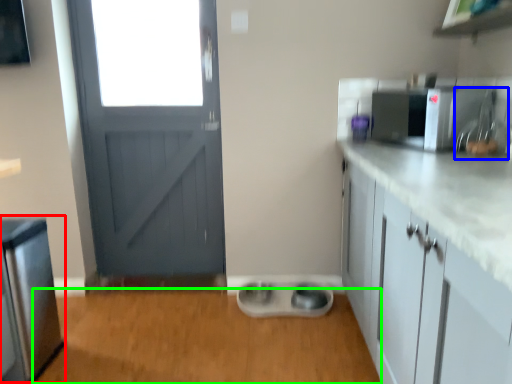
Question: Which object is positioned closest to appliance (highlighted by a red box)? Select from sink (highlighted by a blue box) and plain (highlighted by a green box).

Choices:
 (A) sink
 (B) plain

Answer: (B)